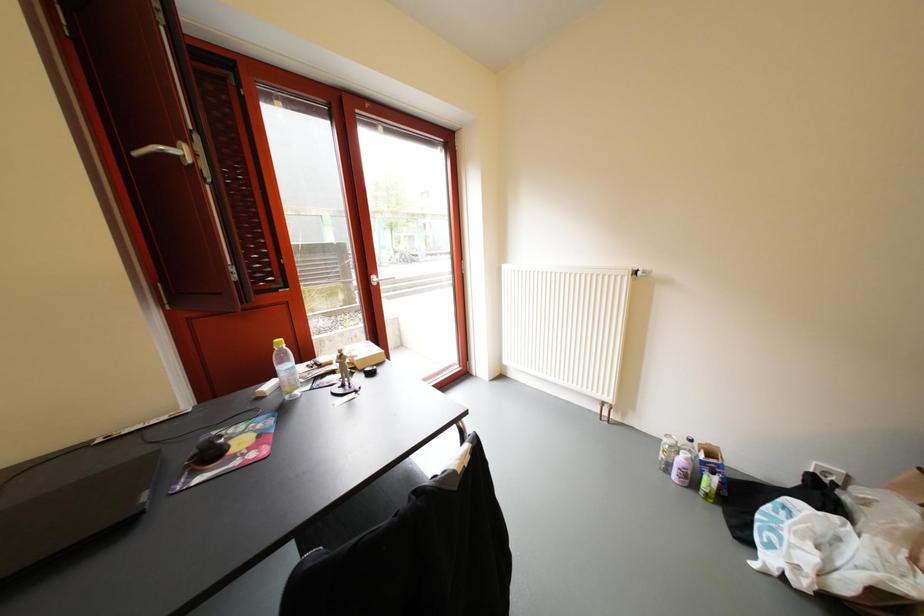
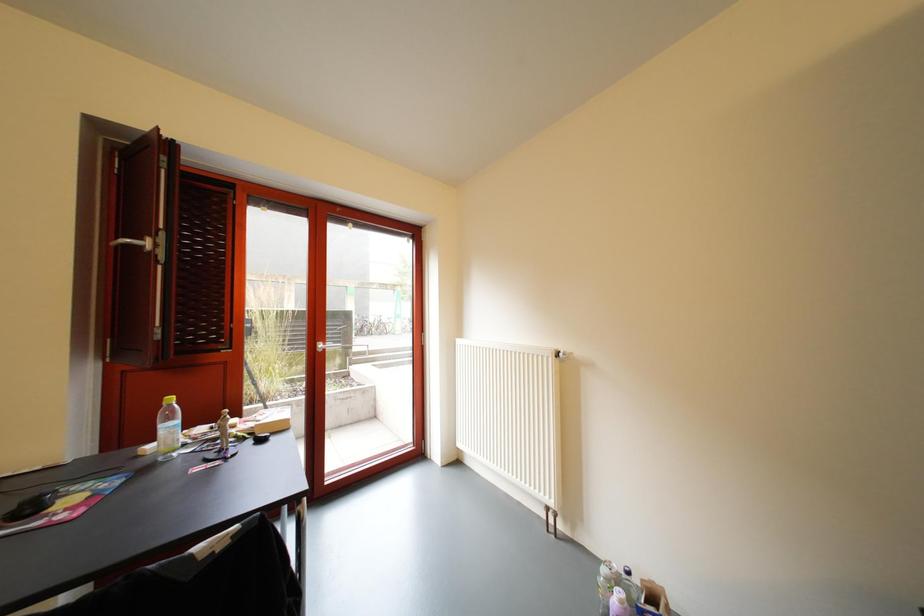
Question: What movement of the cameraman would produce the second image?

Choices:
 (A) Left
 (B) Right
 (C) Forward
 (D) Backward

Answer: (B)